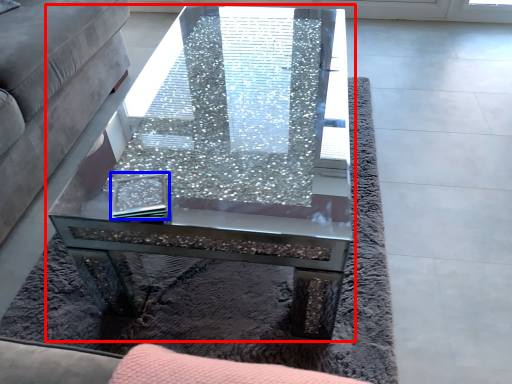
Question: Among these objects, which one is farthest to the camera, coffee table (highlighted by a red box) or pad (highlighted by a blue box)?

Choices:
 (A) coffee table
 (B) pad

Answer: (B)